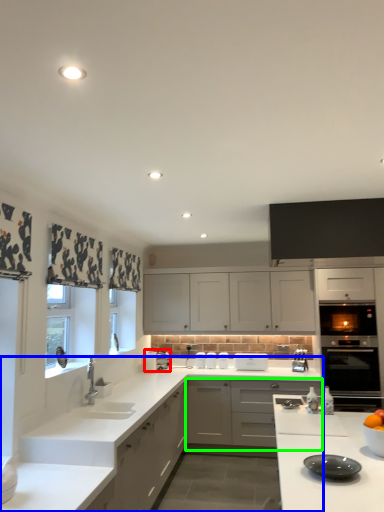
Question: Estimate the real-world distances between objects in this image. Which object is closer to appliance (highlighted by a red box), countertop (highlighted by a blue box) or cabinetry (highlighted by a green box)?

Choices:
 (A) countertop
 (B) cabinetry

Answer: (B)